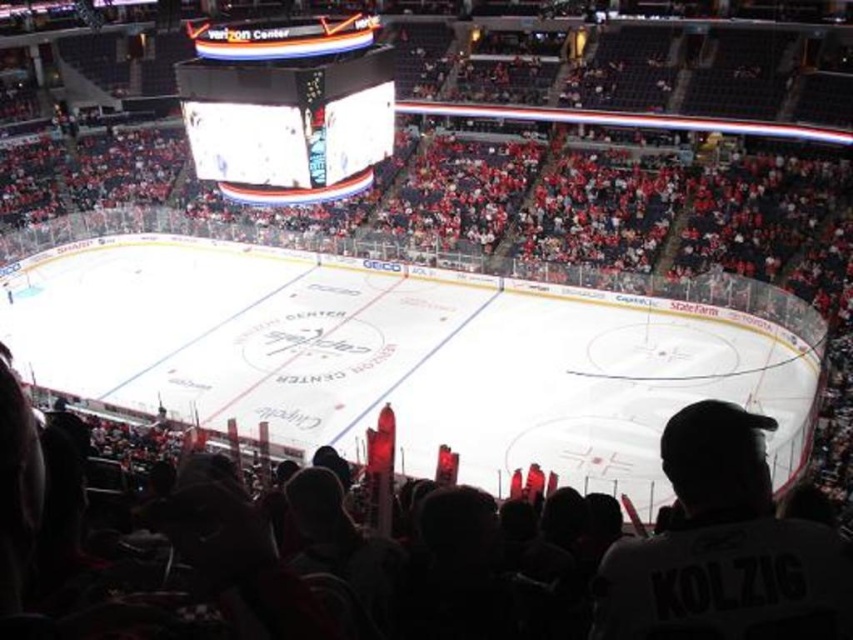
You are a photographer positioned at the edge of the ice rink in the Capital One Arena. You want to take a photo that includes both point (700, 554) and point (184, 74). Which point will appear larger in your photo?

Point (700, 554) will appear larger in the photo because it is closer to the camera than point (184, 74).

You are a photographer positioned at the edge of the ice rink. You want to take a photo that includes both the white jersey at lower right and the white led scoreboard at upper center. Which object should you adjust your camera angle to focus on first to ensure both are in frame?

The white jersey at lower right is not as tall as the white led scoreboard at upper center, so you should focus on the white jersey at lower right first to ensure the scoreboard can be captured in the frame as well.

You are a photographer positioned at the center of the ice rink. You want to take a photo that includes both the white jersey at lower right and the white led scoreboard at upper center. Given that your camera has a 50mm lens, which has a standard field of view, can you capture both objects in a single frame without moving your position? Explain your reasoning.

The white jersey at lower right and white led scoreboard at upper center are 28.52 meters apart. A 50mm lens on a full frame camera has a horizontal field of view of approximately 46 degrees. To determine if both objects can be captured, we need to calculate the angular distance between them. However, without knowing the exact positions relative to the camera or the vertical and horizontal placement, it is impossible to definitively answer. The distance between them is linear, but the angle required depends